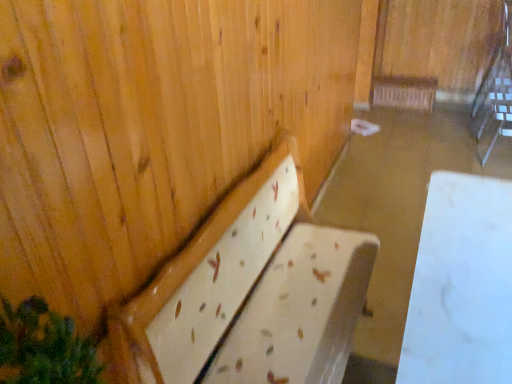
Image resolution: width=512 pixels, height=384 pixels. Describe the element at coordinates (251, 293) in the screenshot. I see `white speckled bench at center-left` at that location.

Find the location of a particular element. The height and width of the screenshot is (384, 512). white speckled bench at center-left is located at coordinates (251, 293).

In order to click on white speckled bench at center-left in this screenshot , I will do `click(251, 293)`.